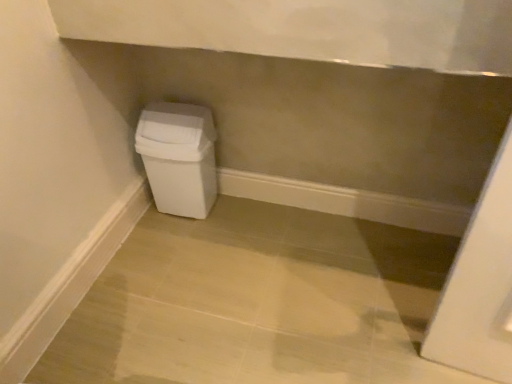
Where is `vacant space in front of white plastic waste bin at lower left`? The width and height of the screenshot is (512, 384). vacant space in front of white plastic waste bin at lower left is located at coordinates (180, 238).